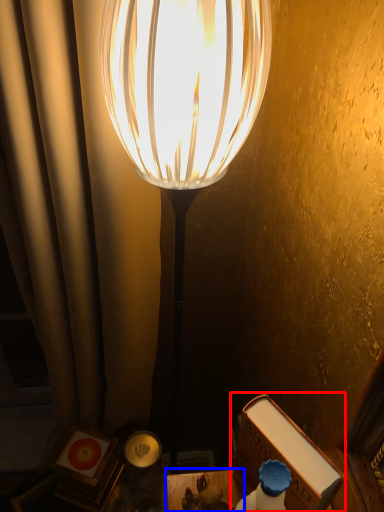
Question: Which of the following is the farthest to the observer, book (highlighted by a red box) or table (highlighted by a blue box)?

Choices:
 (A) book
 (B) table

Answer: (B)